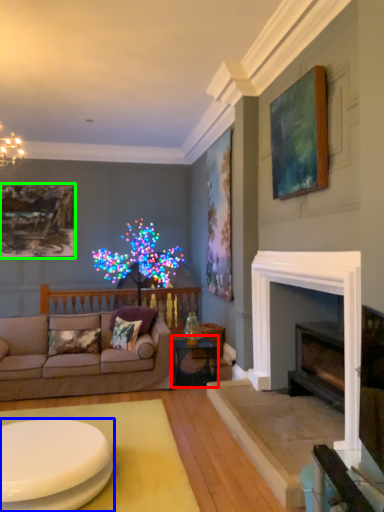
Question: Which object is the farthest from table (highlighted by a red box)? Choose among these: coffee table (highlighted by a blue box) or picture frame (highlighted by a green box).

Choices:
 (A) coffee table
 (B) picture frame

Answer: (B)